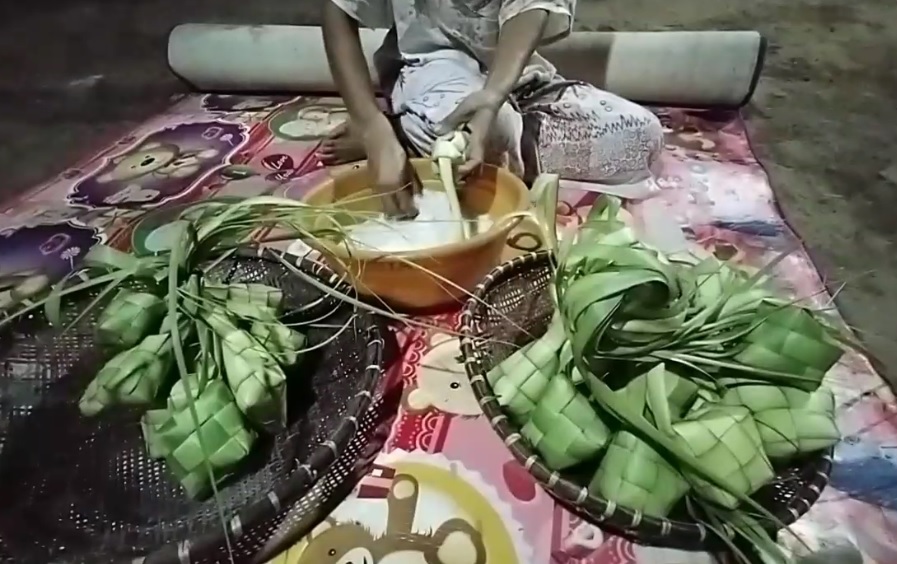
This screenshot has height=564, width=897. In order to click on yellow bowl in this screenshot , I will do `click(427, 286)`.